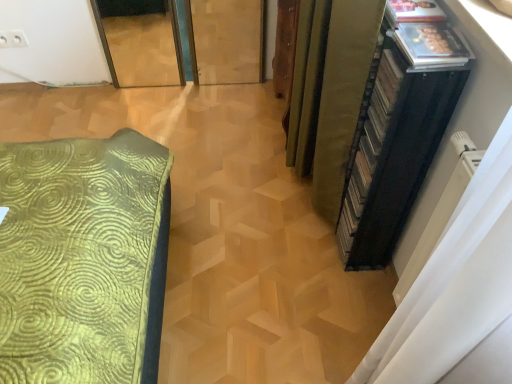
At what (x,y) coordinates should I click in order to perform the action: click on vacant space in front of green fabric curtain at right. Please return your answer as a coordinate pair (x, y). Image resolution: width=512 pixels, height=384 pixels. Looking at the image, I should click on (288, 249).